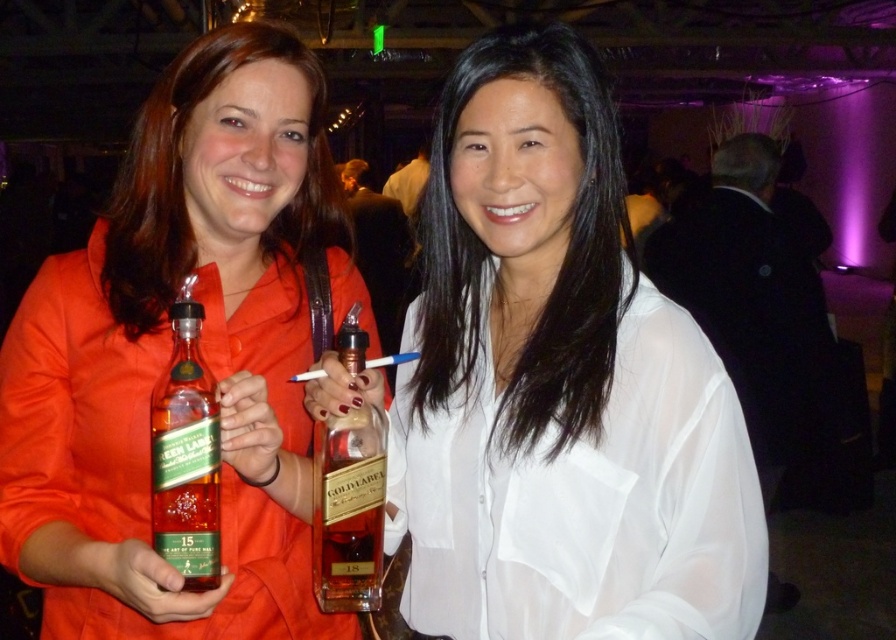
Does white sheer shirt at center have a greater width compared to goldmaterial/texture bottle at center?

Yes.

Looking at this image, is white sheer shirt at center further to the viewer compared to goldmaterial/texture bottle at center?

That is False.

Who is more distant from viewer, (470,525) or (349,365)?

The point (470,525) is behind.

Find the location of a particular element. This screenshot has height=640, width=896. white sheer shirt at center is located at coordinates (558, 385).

The height and width of the screenshot is (640, 896). Find the location of `matte glass bottle at center`. matte glass bottle at center is located at coordinates (169, 353).

Is point (65, 636) behind point (356, 564)?

That is True.

I want to click on matte glass bottle at center, so click(169, 353).

Between green glass bottle at center and goldmaterial/texture bottle at center, which one is positioned higher?

green glass bottle at center is above.

Is the position of green glass bottle at center more distant than that of goldmaterial/texture bottle at center?

No.

Identify the location of green glass bottle at center. The image size is (896, 640). (186, 452).